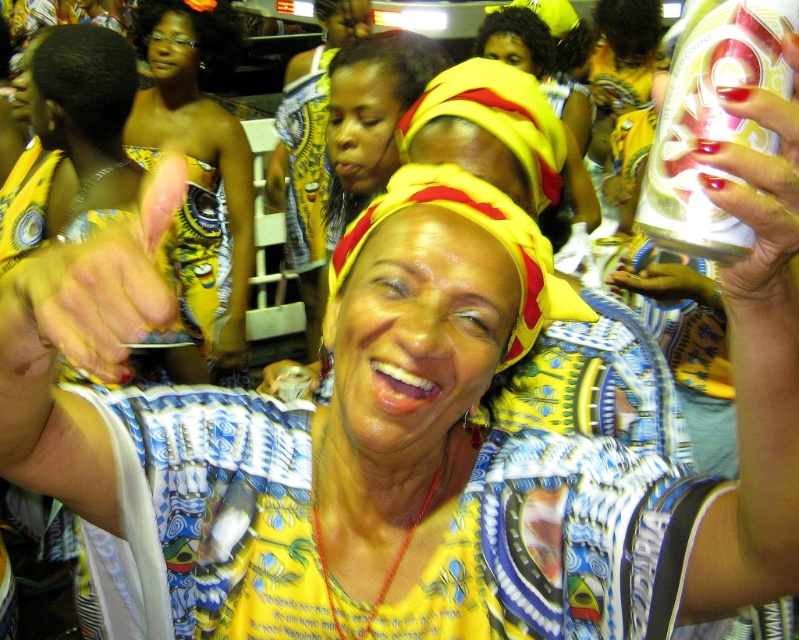
Can you confirm if silver metallic can at upper right is positioned to the right of yellow fabric headband at center?

Correct, you'll find silver metallic can at upper right to the right of yellow fabric headband at center.

Between point (658, 134) and point (287, 259), which one is positioned in front?

Point (658, 134)

The height and width of the screenshot is (640, 799). I want to click on silver metallic can at upper right, so click(710, 120).

Is silver metallic can at upper right above matte yellow headscarf at upper center?

No, silver metallic can at upper right is not above matte yellow headscarf at upper center.

Who is higher up, silver metallic can at upper right or matte yellow headscarf at upper center?

matte yellow headscarf at upper center is above.

Locate an element on the screen. silver metallic can at upper right is located at coordinates (710, 120).

Which is in front, point (249, 189) or point (304, 100)?

Point (249, 189) is in front.

Describe the element at coordinates (201, 147) in the screenshot. This screenshot has width=799, height=640. I see `matte yellow headscarf at upper center` at that location.

At what (x,y) coordinates should I click in order to perform the action: click on matte yellow headscarf at upper center. Please return your answer as a coordinate pair (x, y). The image size is (799, 640). Looking at the image, I should click on (201, 147).